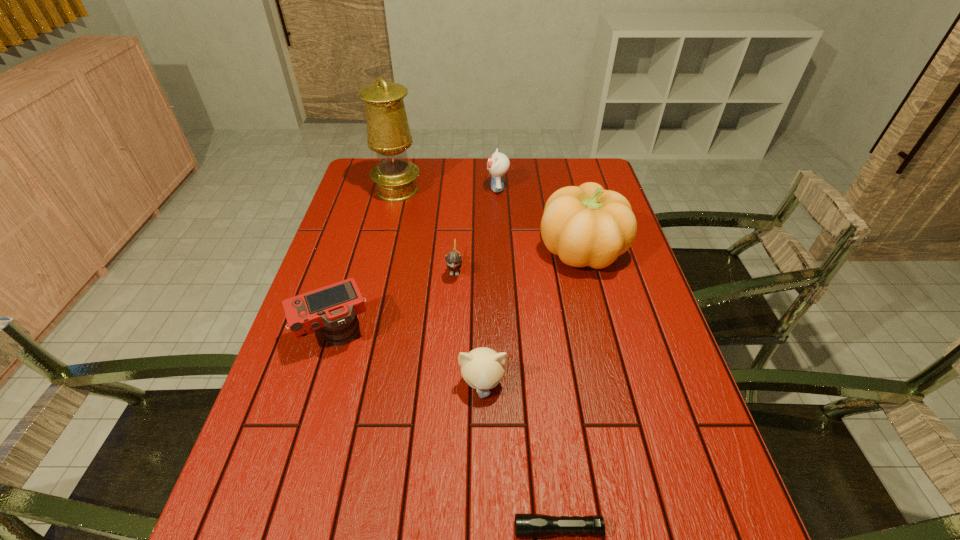
Where is `free space located 0.250m on the front-facing side of the farthest kitten`? free space located 0.250m on the front-facing side of the farthest kitten is located at coordinates (416, 188).

Find the location of a particular element. free spot located 0.240m on the front-facing side of the farthest kitten is located at coordinates (419, 188).

Find the location of `vacant space situated on the front-facing side of the farthest kitten`. vacant space situated on the front-facing side of the farthest kitten is located at coordinates (466, 188).

The width and height of the screenshot is (960, 540). Identify the location of vacant space located on the back of the fifth farthest object. (360, 250).

Identify the location of free space located 0.140m on the face of the nearest kitten. The width and height of the screenshot is (960, 540). (483, 467).

The height and width of the screenshot is (540, 960). Identify the location of free location located 0.140m on the front-facing side of the leftmost kitten. (451, 323).

What are the coordinates of `oil lamp located in the far edge section of the desktop` in the screenshot? It's located at (388, 132).

This screenshot has height=540, width=960. I want to click on kitten that is at the far edge, so click(498, 164).

The width and height of the screenshot is (960, 540). Find the location of `oil lamp present at the left edge`. oil lamp present at the left edge is located at coordinates click(388, 132).

Locate an element on the screen. The image size is (960, 540). camera positioned at the left edge is located at coordinates (333, 308).